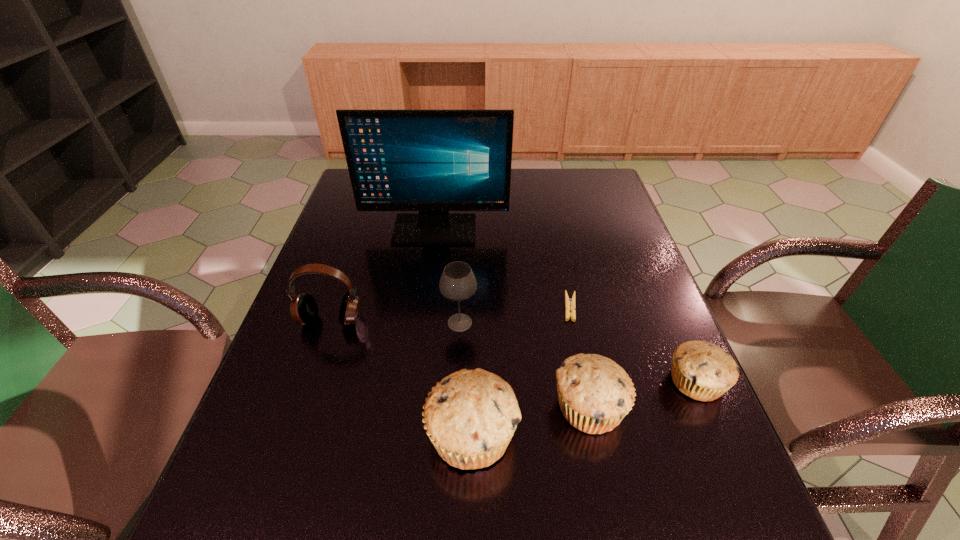
Locate an element on the screen. This screenshot has height=540, width=960. free region located 0.270m on the right of the leftmost muffin is located at coordinates (659, 435).

Find the location of a particular element. free space located 0.060m on the left of the second muffin from right to left is located at coordinates (523, 407).

At what (x,y) coordinates should I click in order to perform the action: click on blank space located 0.320m on the left of the sixth tallest object. Please return your answer as a coordinate pair (x, y). This screenshot has width=960, height=540. Looking at the image, I should click on (516, 382).

Image resolution: width=960 pixels, height=540 pixels. In order to click on vacant space located 0.240m on the left of the wineglass in this screenshot , I will do `click(343, 322)`.

You are a GUI agent. You are given a task and a screenshot of the screen. Output one action in this format:
    pyautogui.click(x=<x>, y=<y>)
    Task: Click on the vacant area situated on the screen side of the farthest object
    This screenshot has width=960, height=540.
    Given the screenshot: What is the action you would take?
    pyautogui.click(x=427, y=292)

I want to click on vacant space located on the ear pads of the headset, so click(307, 390).

This screenshot has height=540, width=960. I want to click on vacant region located on the back of the clothespin, so click(555, 235).

Locate an element on the screen. monitor that is at the left edge is located at coordinates (433, 161).

The height and width of the screenshot is (540, 960). What are the coordinates of `headset situated at the left edge` in the screenshot? It's located at (304, 310).

This screenshot has height=540, width=960. In order to click on object that is positioned at the near right corner in this screenshot , I will do `click(594, 393)`.